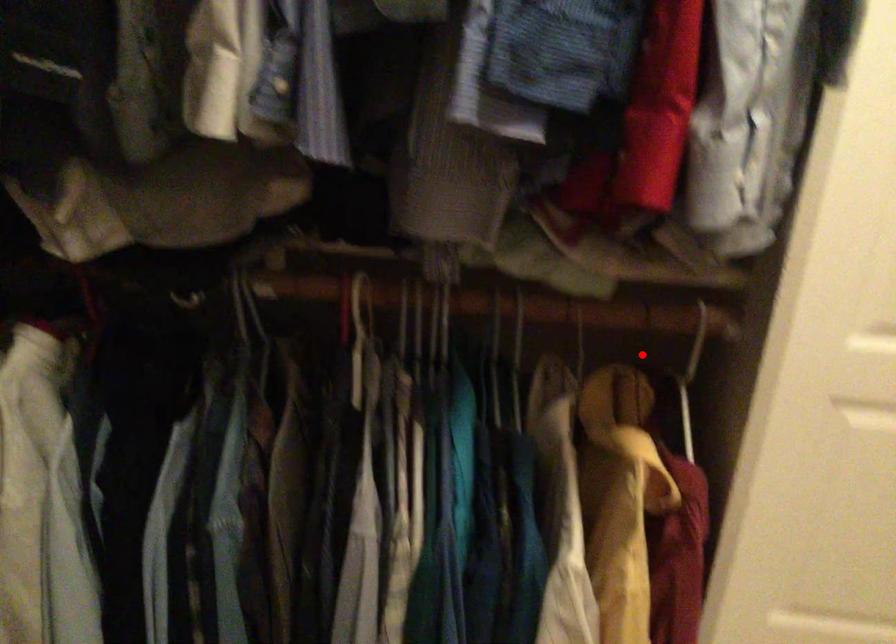
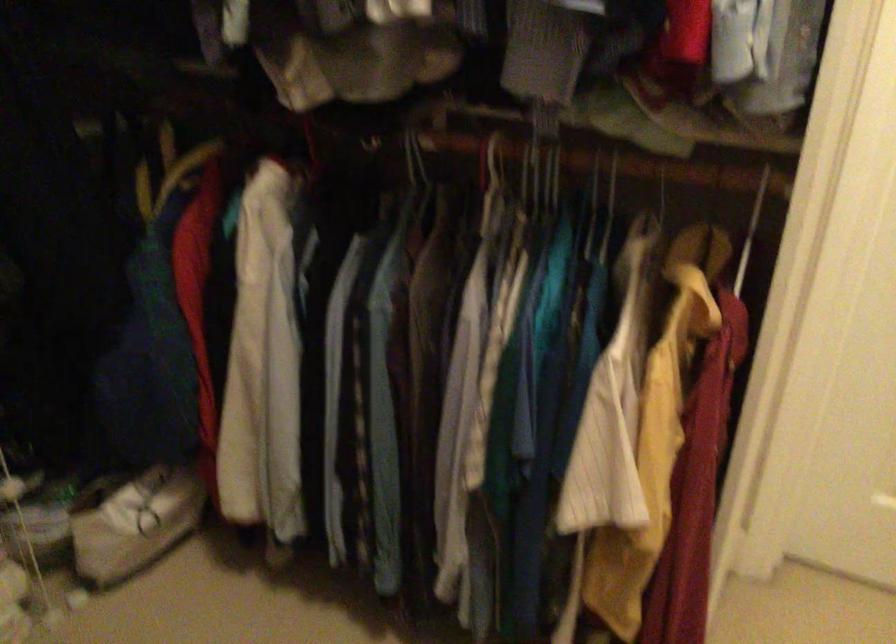
Where in the second image is the point corresponding to the highlighted location from the first image?

(751, 230)